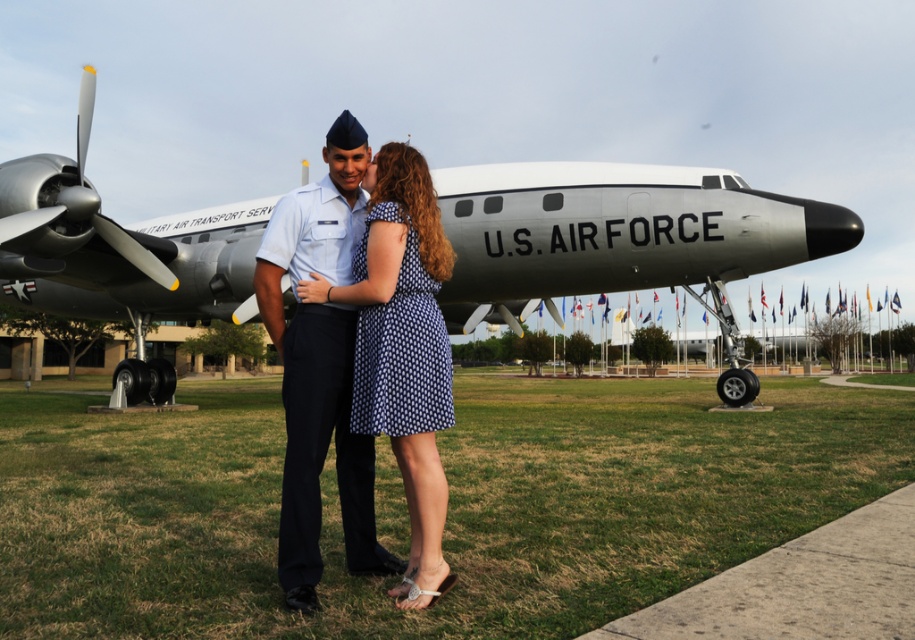
Is silver metallic airplane at center wider than light blue uniform at center?

Correct, the width of silver metallic airplane at center exceeds that of light blue uniform at center.

Can you confirm if silver metallic airplane at center is positioned to the right of light blue uniform at center?

In fact, silver metallic airplane at center is to the left of light blue uniform at center.

Is point (770, 268) positioned before point (304, 525)?

No.

Locate an element on the screen. silver metallic airplane at center is located at coordinates (616, 234).

Between light blue uniform at center and silver metallic propeller at upper left, which one appears on the left side from the viewer's perspective?

From the viewer's perspective, silver metallic propeller at upper left appears more on the left side.

Between light blue uniform at center and silver metallic propeller at upper left, which one is positioned lower?

Positioned lower is light blue uniform at center.

What do you see at coordinates (320, 365) in the screenshot?
I see `light blue uniform at center` at bounding box center [320, 365].

The height and width of the screenshot is (640, 915). I want to click on light blue uniform at center, so click(x=320, y=365).

Does silver metallic airplane at center lie behind silver metallic propeller at upper left?

No, it is in front of silver metallic propeller at upper left.

Locate an element on the screen. The image size is (915, 640). silver metallic airplane at center is located at coordinates (616, 234).

Does point (547, 227) come farther from viewer compared to point (19, 204)?

Yes.

Identify the location of silver metallic airplane at center. This screenshot has height=640, width=915. (616, 234).